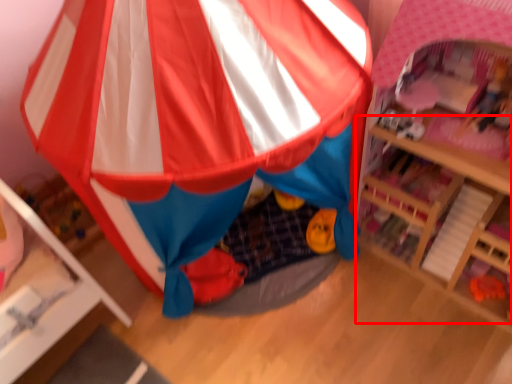
Question: From the image's perspective, what is the correct spatial relationship of table (annotated by the red box) in relation to tent?

Choices:
 (A) above
 (B) below

Answer: (B)